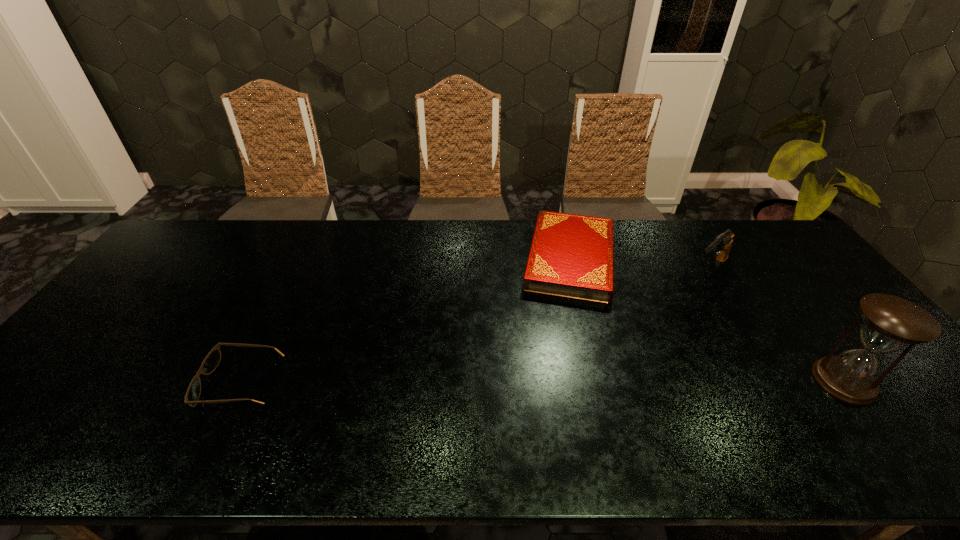
In order to click on free spot on the desktop that is between the leftmost object and the hourglass and is positioned along the barrel of the second object from right to left in this screenshot , I will do `click(582, 382)`.

This screenshot has width=960, height=540. Identify the location of free space on the desktop that is between the sunglasses and the rightmost object and is positioned on the cover of the second object from left to right. (557, 382).